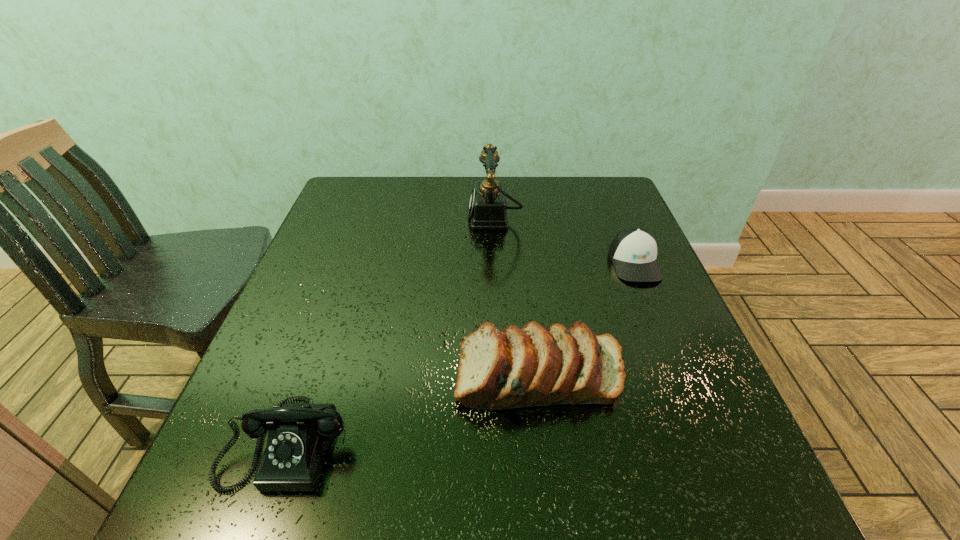
Image resolution: width=960 pixels, height=540 pixels. I want to click on free point between the bread and the tallest object, so click(517, 296).

Identify the location of empty space that is in between the taller telephone and the shortest object. The width and height of the screenshot is (960, 540). (564, 240).

Find the location of `free space between the left telephone and the tallest object`. free space between the left telephone and the tallest object is located at coordinates (392, 330).

The height and width of the screenshot is (540, 960). In order to click on vacant area between the taller telephone and the rightmost object in this screenshot , I will do `click(564, 240)`.

This screenshot has width=960, height=540. Find the location of `object identified as the second closest to the bread`. object identified as the second closest to the bread is located at coordinates (633, 251).

At what (x,y) coordinates should I click in order to perform the action: click on object that is the third closest one to the rightmost object. Please return your answer as a coordinate pair (x, y). Looking at the image, I should click on (299, 435).

The height and width of the screenshot is (540, 960). Find the location of `vacant point that satisfies the following two spatial constraints: 1. on the front of the farther telephone at the rotary dial; 2. on the dial of the nearer telephone`. vacant point that satisfies the following two spatial constraints: 1. on the front of the farther telephone at the rotary dial; 2. on the dial of the nearer telephone is located at coordinates (504, 442).

Where is `vacant area in the image that satisfies the following two spatial constraints: 1. on the front of the taller telephone at the rotary dial; 2. on the dial of the shorter telephone`? vacant area in the image that satisfies the following two spatial constraints: 1. on the front of the taller telephone at the rotary dial; 2. on the dial of the shorter telephone is located at coordinates (504, 442).

You are a GUI agent. You are given a task and a screenshot of the screen. Output one action in this format:
    pyautogui.click(x=<x>, y=<y>)
    Task: Click on the vacant space that satisfies the following two spatial constraints: 1. on the front of the bread at the rotary dial; 2. on the right side of the right telephone
    This screenshot has width=960, height=540.
    Given the screenshot: What is the action you would take?
    pyautogui.click(x=501, y=375)

This screenshot has width=960, height=540. What are the coordinates of `vacant region that satisfies the following two spatial constraints: 1. on the front of the right telephone at the rotary dial; 2. on the dial of the leftmost object` in the screenshot? It's located at (504, 442).